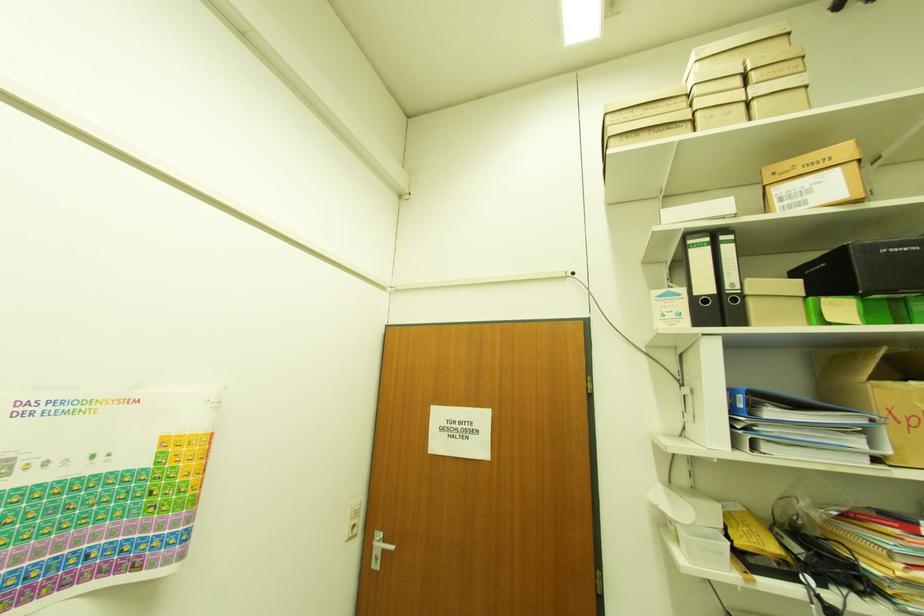
Which object does [882,265] point to?

This point indicates the black storage box.